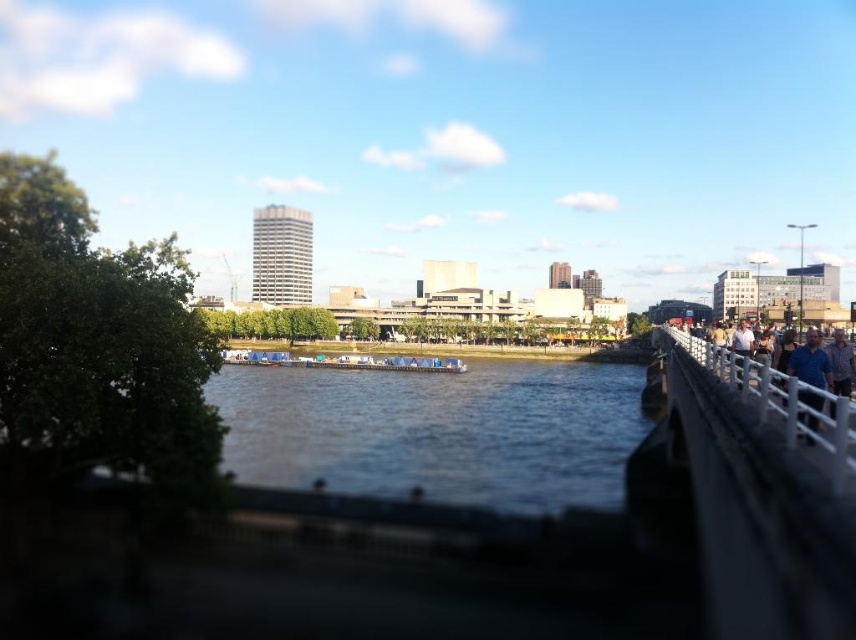
Question: Which of the following is the farthest from the observer?

Choices:
 (A) (614, 388)
 (B) (733, 336)
 (C) (817, 408)

Answer: (A)

Question: Can you confirm if blue water at center is positioned above white plastic boat at center?

Choices:
 (A) yes
 (B) no

Answer: (B)

Question: Where is blue shirt at right located in relation to light brown wooden railing at right in the image?

Choices:
 (A) left
 (B) right

Answer: (B)

Question: Which point is closer to the camera?

Choices:
 (A) light brown wooden railing at right
 (B) white plastic boat at center

Answer: (A)

Question: Is white metal railing at right smaller than white plastic boat at center?

Choices:
 (A) yes
 (B) no

Answer: (A)

Question: Which point is farther to the camera?

Choices:
 (A) white plastic boat at center
 (B) blue water at center
 (C) light brown wooden railing at right
 (D) white metal railing at right

Answer: (B)